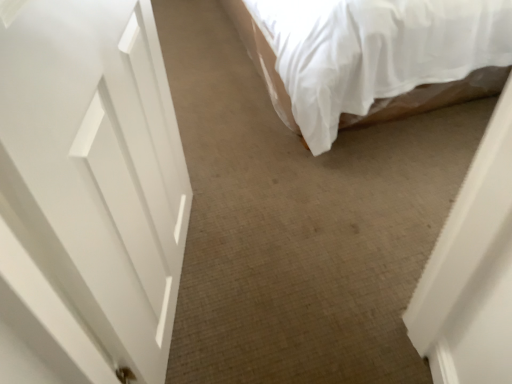
You are a GUI agent. You are given a task and a screenshot of the screen. Output one action in this format:
    pyautogui.click(x=<x>, y=<y>)
    Task: Click on the vacant space in between white glossy door at left and white fabric bed at upper right
    
    Given the screenshot: What is the action you would take?
    pyautogui.click(x=291, y=183)